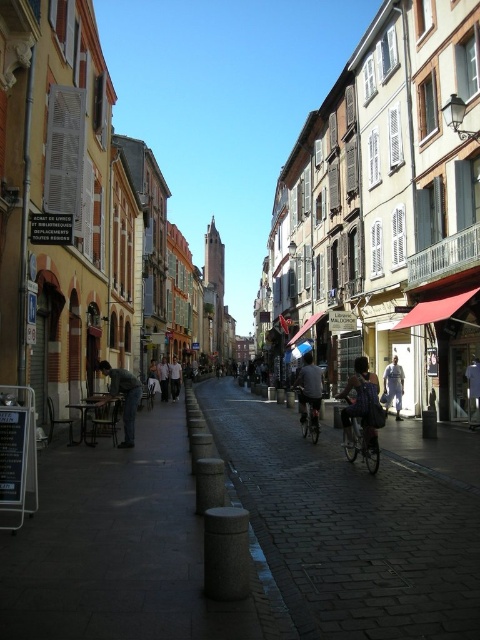
You are a tourist standing on the cobblestone street in the European town. You see a metallic silver bicycle at center and a light beige shirt at center. If you want to take a photo of both objects in the same frame, will you need to zoom in or out?

The metallic silver bicycle at center and light beige shirt at center are 55.24 meters apart from each other. To capture both in the same frame, you would need to zoom out to widen the field of view.

You are a tourist in this European town and want to take a photo of both the metallic silver bicycle at center and the light brown leather jacket at center. Your camera can capture objects within a 50 meter range. Will both items be in the same photo?

The metallic silver bicycle at center is 52.42 meters away from the light brown leather jacket at center. Since the camera can only capture objects within 50 meters, the distance between them exceeds the camera range, so they cannot be in the same photo.

You are a tourist walking down the street and you see a dark gray jeans at left and a light brown leather jacket at center. Which one is positioned more to the right side of the street?

The dark gray jeans at left is positioned more to the right side of the street than the light brown leather jacket at center.